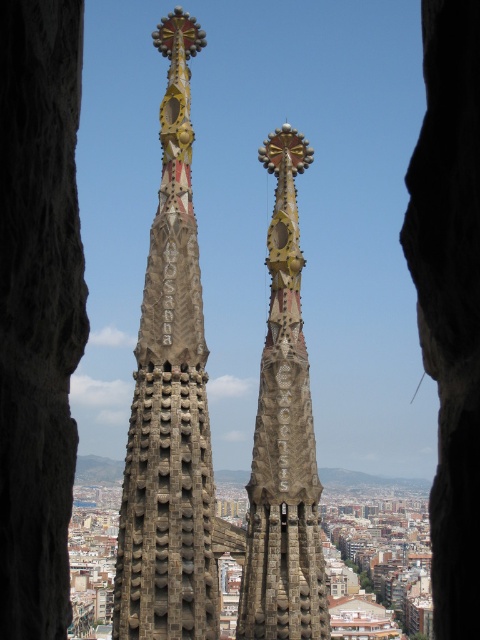
Can you confirm if rustic stone spire at center is positioned to the right of stone spire at center?

Incorrect, rustic stone spire at center is not on the right side of stone spire at center.

How far apart are rustic stone spire at center and stone spire at center?

The distance of rustic stone spire at center from stone spire at center is 7.61 meters.

Which is in front, point (141, 348) or point (271, 435)?

Point (141, 348) is more forward.

Locate an element on the screen. This screenshot has width=480, height=640. rustic stone spire at center is located at coordinates 169,401.